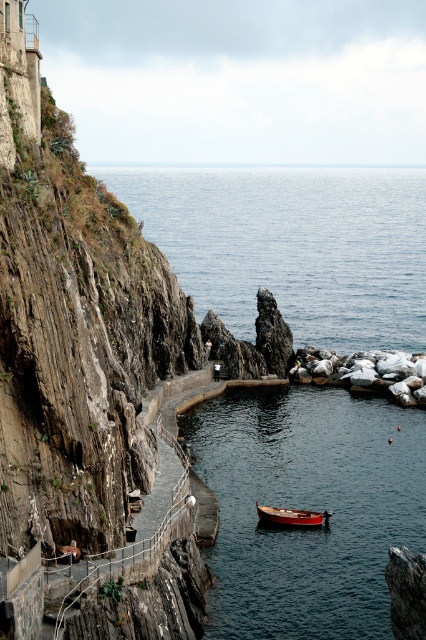
You are standing at the cliff edge and see the point marked at coordinates (291, 244). What is the color of the object located at that point?

The point at coordinates (291, 244) corresponds to blue water at center, so the color is blue.